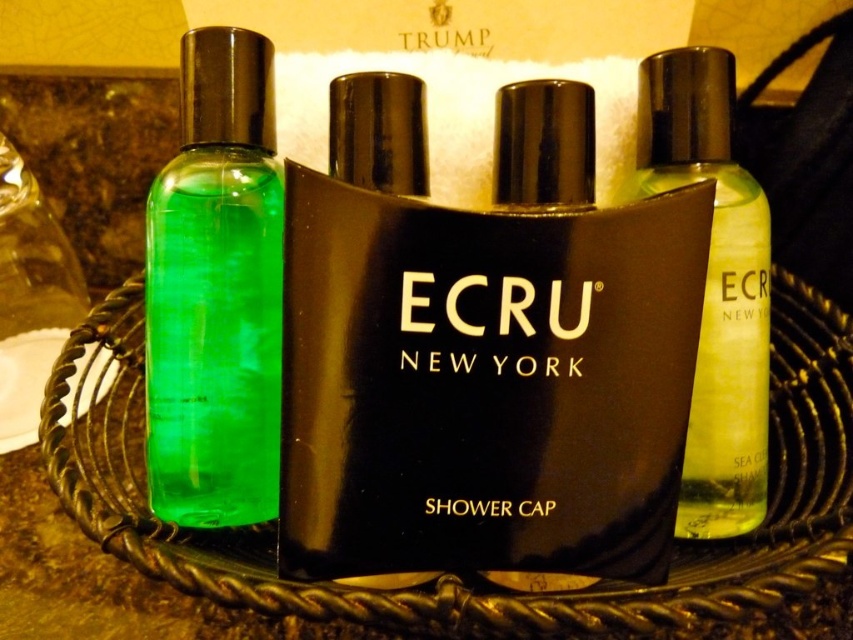
You are organizing a gift set and need to place the black glossy shower cap at center and the black matte shower cap at center into a small display case. Which shower cap should you place first to ensure both fit properly?

The black glossy shower cap at center is closer to the viewer than the black matte shower cap at center, so you should place the black glossy shower cap at center first to ensure proper positioning.

You are packing a small toiletry bag for a trip and have limited space. You need to decide whether the black glossy shower cap at center can fit into the same compartment as the transparent yellow liquid at right. Based on their sizes, which one takes up more space?

The black glossy shower cap at center has a larger size compared to the transparent yellow liquid at right, so it takes up more space.

You are organizing a bathroom shelf and need to decide where to place the green translucent bottle at left and the black matte shower cap at center. Based on their sizes, which item should be placed in a smaller section of the shelf?

The green translucent bottle at left should be placed in the smaller section because it occupies less space than the black matte shower cap at center.